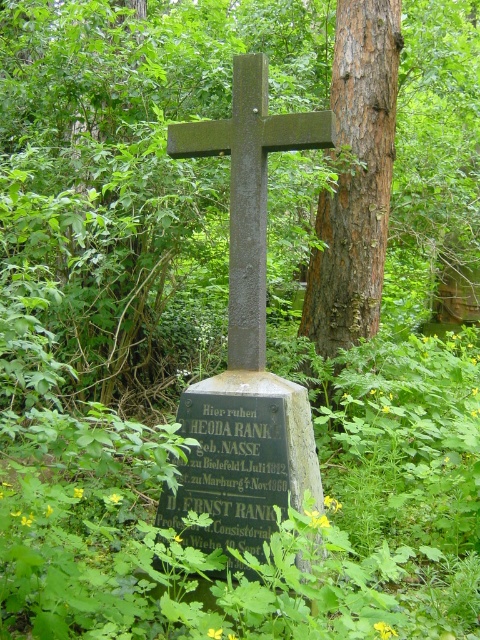
Does brown rough bark tree at center appear on the right side of dark gray stone cross at center?

Indeed, brown rough bark tree at center is positioned on the right side of dark gray stone cross at center.

Is brown rough bark tree at center in front of dark gray stone cross at center?

No, it is not.

What do you see at coordinates (356, 179) in the screenshot?
I see `brown rough bark tree at center` at bounding box center [356, 179].

You are a GUI agent. You are given a task and a screenshot of the screen. Output one action in this format:
    pyautogui.click(x=<x>, y=<y>)
    Task: Click on the brown rough bark tree at center
    
    Given the screenshot: What is the action you would take?
    pyautogui.click(x=356, y=179)

Does black stone plaque at center lie behind dark gray stone cross at center?

No, it is not.

Is black stone plaque at center in front of dark gray stone cross at center?

Yes.

Locate an element on the screen. The image size is (480, 640). black stone plaque at center is located at coordinates (229, 472).

Which is more to the right, brown rough bark tree at center or black stone plaque at center?

From the viewer's perspective, brown rough bark tree at center appears more on the right side.

Is point (349, 65) more distant than point (260, 410)?

Yes, it is behind point (260, 410).

At what (x,y) coordinates should I click in order to perform the action: click on brown rough bark tree at center. Please return your answer as a coordinate pair (x, y). The image size is (480, 640). Looking at the image, I should click on (356, 179).